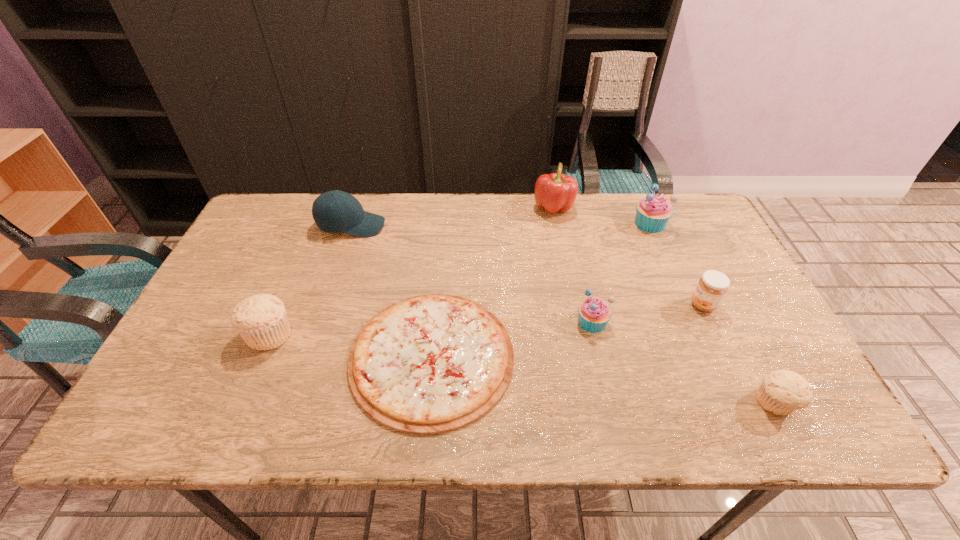
This screenshot has width=960, height=540. Identify the location of object positioned at the near right corner. (781, 392).

Find the location of a particular element. This screenshot has width=960, height=540. vacant position at the near edge of the desktop is located at coordinates (293, 400).

What are the coordinates of `vacant space at the left edge` in the screenshot? It's located at (204, 348).

In order to click on vacant region at the right edge of the desktop in this screenshot , I will do `click(684, 280)`.

Locate an element on the screen. This screenshot has width=960, height=540. free space at the far left corner is located at coordinates (263, 206).

At what (x,y) coordinates should I click in order to perform the action: click on free spot at the far right corner of the desktop. Please return your answer as a coordinate pair (x, y). Looking at the image, I should click on (675, 204).

Identify the location of free space at the near right corner. The width and height of the screenshot is (960, 540). (739, 403).

The height and width of the screenshot is (540, 960). In order to click on unoccupied area between the farther beige muffin and the blue baseball cap in this screenshot , I will do `click(310, 280)`.

Find the location of a particular element. free space between the smaller beige muffin and the shortest object is located at coordinates (604, 380).

Locate an element on the screen. Image resolution: width=960 pixels, height=540 pixels. empty location between the farther beige muffin and the pepper is located at coordinates (412, 271).